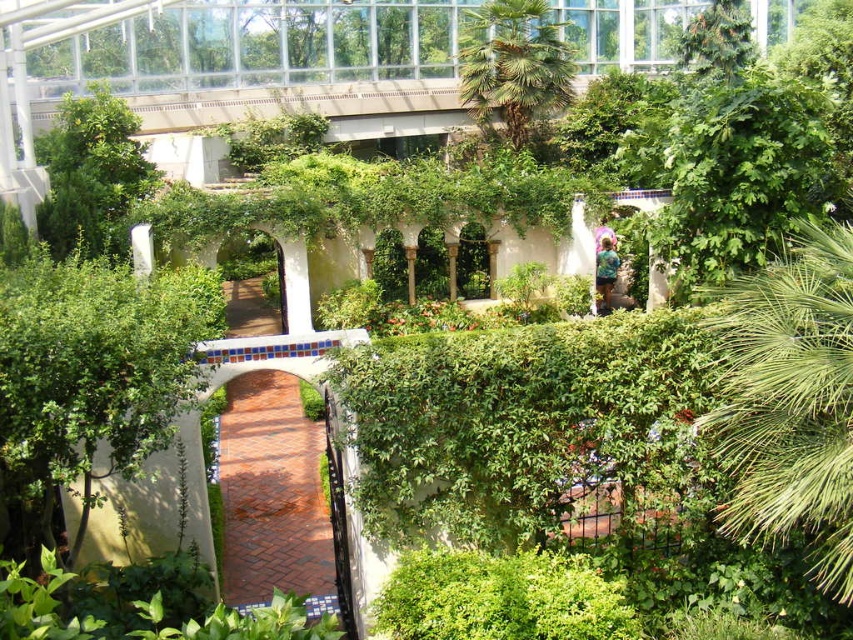
Question: Is green leafy palm at right further to camera compared to brick at center?

Choices:
 (A) yes
 (B) no

Answer: (B)

Question: Which point is farther from the camera taking this photo?

Choices:
 (A) (39, 518)
 (B) (315, 490)
 (C) (846, 264)

Answer: (B)

Question: Based on their relative distances, which object is nearer to the green leafy palm tree at upper center?

Choices:
 (A) green leafy palm at right
 (B) green leafy tree at upper left
 (C) green leafy bush at lower left

Answer: (B)

Question: Which point appears closest to the camera in this image?

Choices:
 (A) (189, 376)
 (B) (556, 93)

Answer: (A)

Question: Can you confirm if green leafy bush at lower left is positioned to the left of green leafy palm at right?

Choices:
 (A) no
 (B) yes

Answer: (B)

Question: Does green leafy palm at right lie behind brick at center?

Choices:
 (A) no
 (B) yes

Answer: (A)